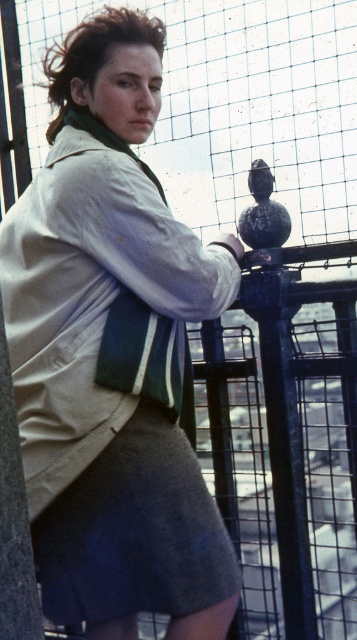
Who is higher up, beige cotton jacket at upper left or gray cotton skirt at lower center?

beige cotton jacket at upper left is higher up.

Does beige cotton jacket at upper left have a greater height compared to gray cotton skirt at lower center?

Indeed, beige cotton jacket at upper left has a greater height compared to gray cotton skirt at lower center.

Find the location of a particular element. beige cotton jacket at upper left is located at coordinates (98, 300).